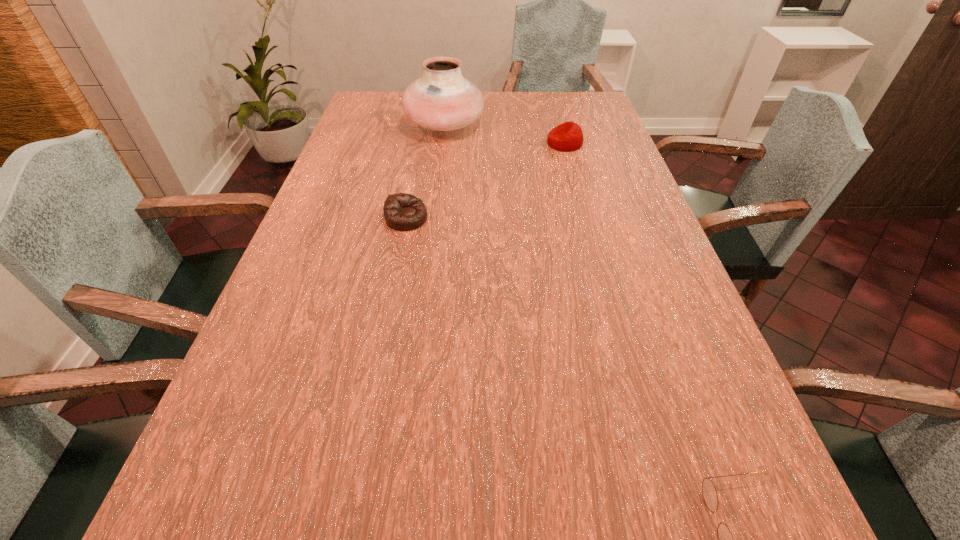
Where is `object that stands as the third closest to the second tallest object`? This screenshot has width=960, height=540. object that stands as the third closest to the second tallest object is located at coordinates (725, 538).

At what (x,y) coordinates should I click in order to perform the action: click on the second closest object to the spectacles. Please return your answer as a coordinate pair (x, y). This screenshot has width=960, height=540. Looking at the image, I should click on (568, 136).

Image resolution: width=960 pixels, height=540 pixels. What are the coordinates of `free space in the image that satisfies the following two spatial constraints: 1. on the back side of the shorter beanbag; 2. on the right side of the pottery` in the screenshot? It's located at (424, 125).

Locate an element on the screen. The width and height of the screenshot is (960, 540). free point that satisfies the following two spatial constraints: 1. on the back side of the second nearest object; 2. on the left side of the tallest object is located at coordinates click(424, 125).